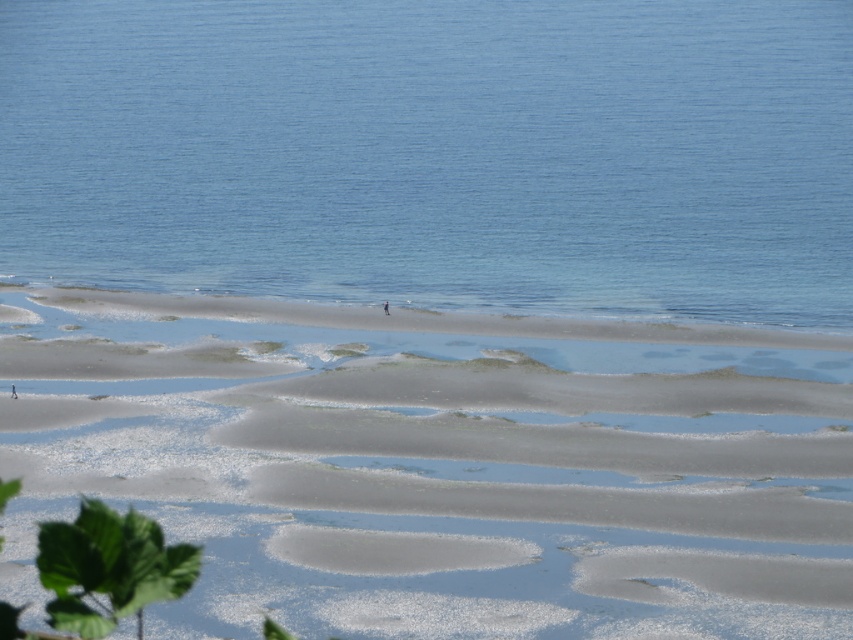
You are standing on the beach and see two points marked on the sand. The first point is at coordinates point (x=323, y=264) and the second is at point (x=490, y=320). Which point is closer to you?

Point (x=323, y=264) is further to the camera than point (x=490, y=320), so the second point is closer to you.

You are standing on the sandy at lower center and want to reach the clear blue water at center. Based on the scene description, which direction should you move to get to the water?

You should move forward towards the clear blue water at center because it is located in the middle ground closer to the water edge, while the sandy at lower center is in the foreground. The clear blue water at center is wider than the sandy at lower center, so moving forward in that direction will lead you to the water.

You are standing on the beach and want to walk to the clear blue water at center. Which direction should you move relative to the sandy at lower center?

You should move forward towards the clear blue water at center, as it is above the sandy at lower center in the image, indicating it is closer to the water edge.